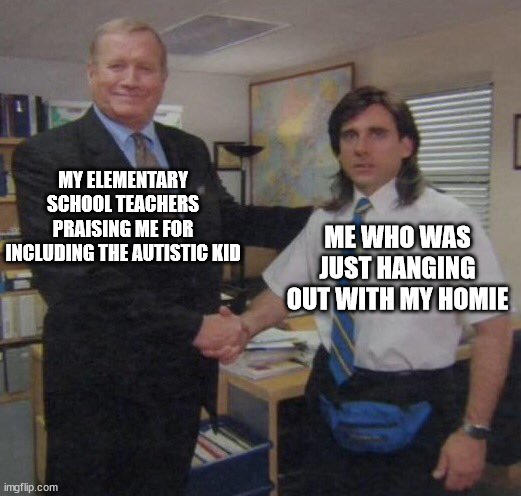
This screenshot has height=496, width=521. In order to click on mini blinds in this screenshot , I will do `click(473, 135)`.